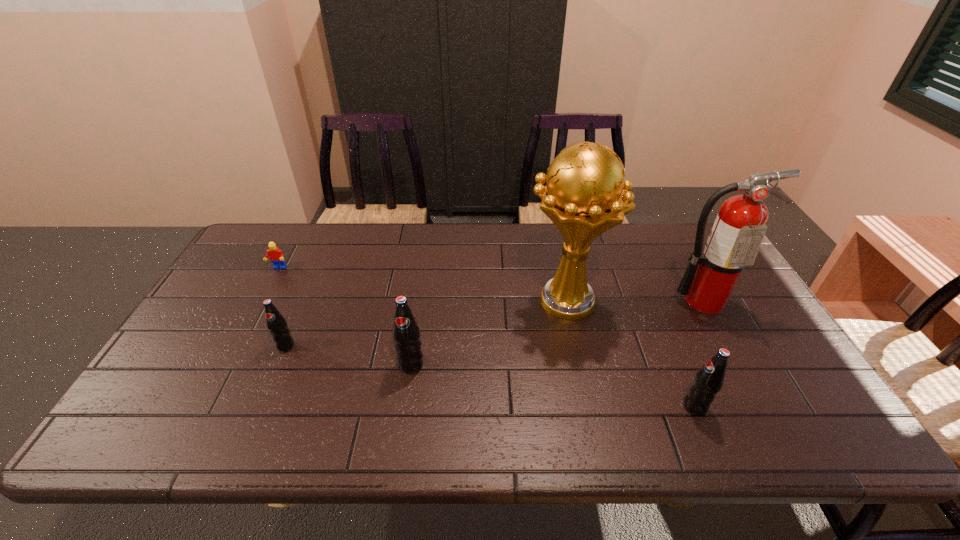
You are a GUI agent. You are given a task and a screenshot of the screen. Output one action in this format:
    pyautogui.click(x=<x>, y=<y>)
    Task: Click on the blank region between the second pop from left to right and the leftmost object
    This screenshot has height=540, width=960.
    Given the screenshot: What is the action you would take?
    pyautogui.click(x=345, y=316)

Find the location of `object that is the closest to the third object from right to left`. object that is the closest to the third object from right to left is located at coordinates (739, 228).

Locate which object ranks third in proximity to the Lego. Please provide its 2D coordinates. Your answer should be formatted as a tuple, i.e. [(x, y)], where the tuple contains the x and y coordinates of a point satisfying the conditions above.

[(585, 195)]

Choose which pop is the second nearest neighbor to the second pop from left to right. Please provide its 2D coordinates. Your answer should be formatted as a tuple, i.e. [(x, y)], where the tuple contains the x and y coordinates of a point satisfying the conditions above.

[(709, 380)]

This screenshot has width=960, height=540. Find the location of `the third closest pop to the fourth object from left to right`. the third closest pop to the fourth object from left to right is located at coordinates coord(276,324).

At what (x,y) coordinates should I click in order to perform the action: click on blank area in the image that satisfies the following two spatial constraints: 1. on the nozzle side of the fire extinguisher; 2. at the front of the fourth object from left to right where the globe is prominent. Please return your answer as a coordinate pair (x, y). Looking at the image, I should click on (704, 301).

Locate an element on the screen. This screenshot has height=540, width=960. vacant region that satisfies the following two spatial constraints: 1. at the front of the fourth object from left to right where the globe is prominent; 2. on the front label of the second shortest object is located at coordinates (574, 346).

At what (x,y) coordinates should I click in order to perform the action: click on free space that satisfies the following two spatial constraints: 1. at the front of the trophy_cup where the globe is prominent; 2. on the front label of the second object from left to right. Please return your answer as a coordinate pair (x, y). The image size is (960, 540). Looking at the image, I should click on (574, 346).